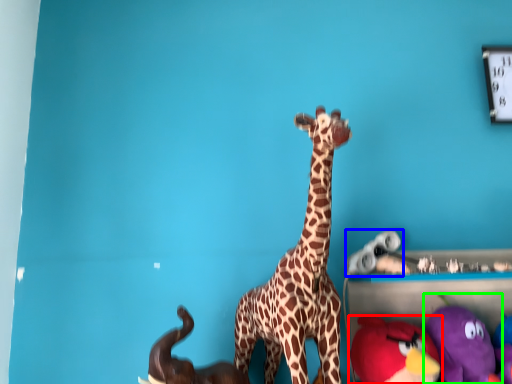
Question: Which is nearer to the toy (highlighted by a red box)? toy (highlighted by a blue box) or toy (highlighted by a green box).

Choices:
 (A) toy
 (B) toy

Answer: (B)